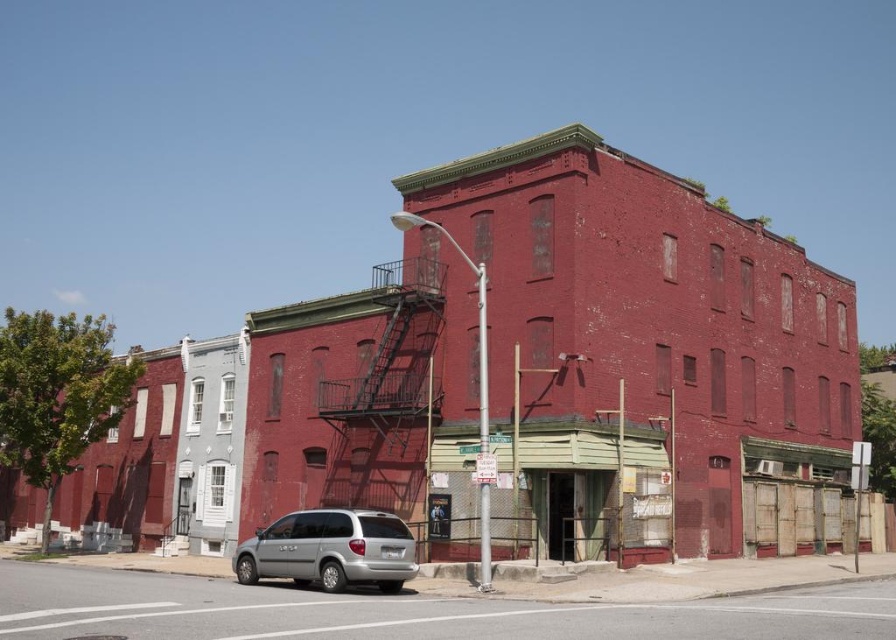
Is point (383, 502) positioned after point (270, 538)?

Yes, point (383, 502) is behind point (270, 538).

Who is more distant from viewer, (407, 340) or (291, 560)?

The point (407, 340) is behind.

Locate an element on the screen. This screenshot has height=640, width=896. rusty metal fire escape at center is located at coordinates (388, 396).